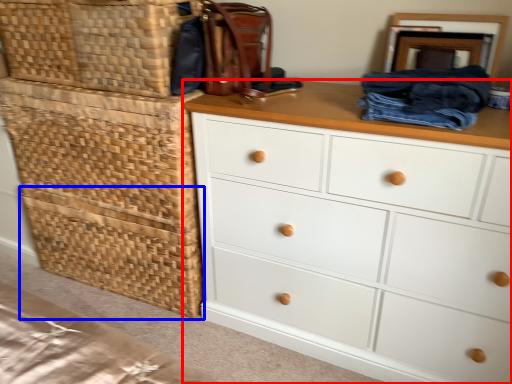
Question: Which of the following is the closest to the observer, chest of drawers (highlighted by a red box) or basket (highlighted by a blue box)?

Choices:
 (A) chest of drawers
 (B) basket

Answer: (A)